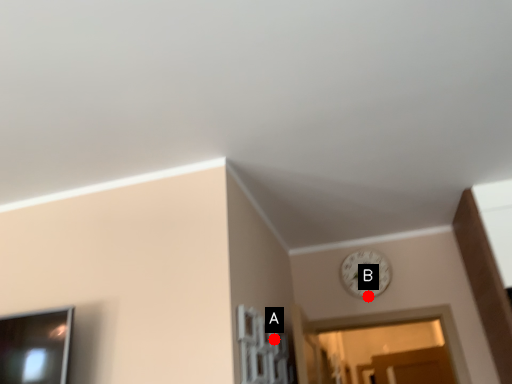
Question: Two points are circled on the image, labeled by A and B beside each circle. Which point appears farthest from the camera in this image?

Choices:
 (A) A is further
 (B) B is further

Answer: (B)